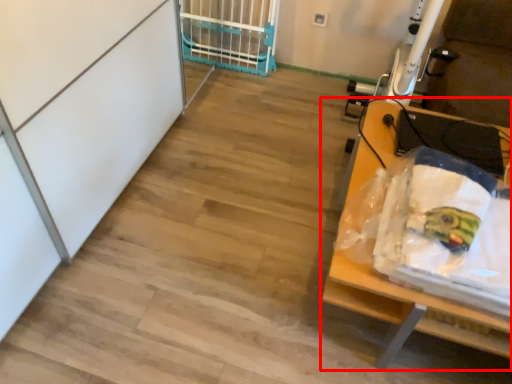
Question: From the image's perspective, what is the correct spatial positioning of furniture (annotated by the red box) in reference to cage?

Choices:
 (A) above
 (B) below

Answer: (B)